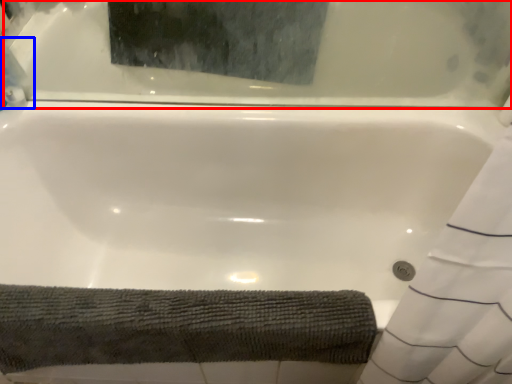
Question: Which object is further to the camera taking this photo, bathtub (highlighted by a red box) or cleaning product (highlighted by a blue box)?

Choices:
 (A) bathtub
 (B) cleaning product

Answer: (B)